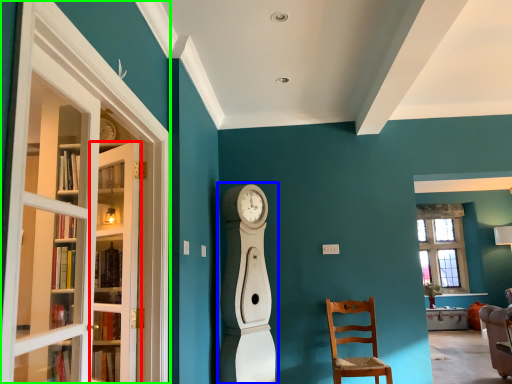
Question: Which object is positioned farthest from door (highlighted by a red box)? Select from open (highlighted by a blue box) and screen door (highlighted by a green box).

Choices:
 (A) open
 (B) screen door

Answer: (A)